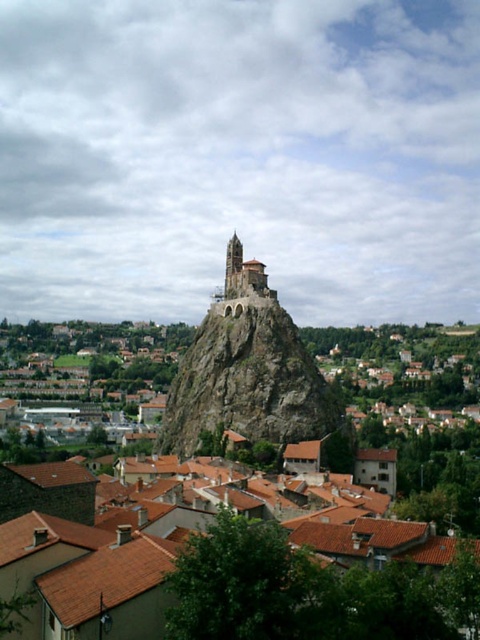
You are an architect planning to build a new observation deck. You need to choose between the rocky cliff at center and the smooth stone tower at center. Which location has a wider base to accommodate a larger deck?

The rocky cliff at center has a wider base than the smooth stone tower at center, so it can accommodate a larger deck.

You are an architect planning to build a new observation deck. You want to ensure it can accommodate a large crowd. Given the brown tiled roofs at center and the rocky cliff at center, which location offers more space for the deck?

The brown tiled roofs at center has a larger size compared to the rocky cliff at center, so the brown tiled roofs at center would provide more space for the observation deck.